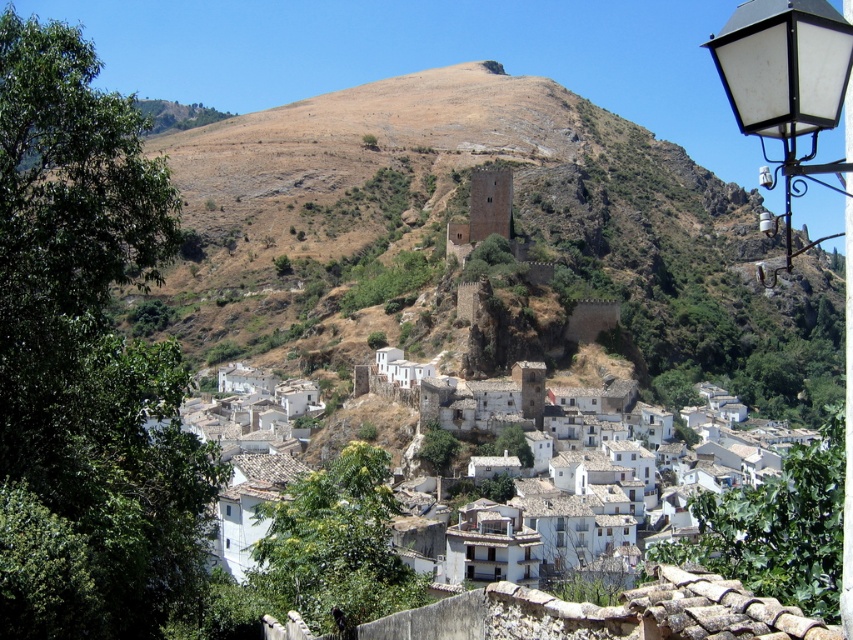
You are a tourist standing at the base of the hill, looking towards the village. You notice the white matte street light at upper right and the white stone buildings at center. Which object appears taller in the scene?

The white matte street light at upper right appears much taller than the white stone buildings at center in the scene.

You are a tourist standing in the village and want to take a photo that includes both the brown rocky mountain at center and the white stone buildings at center. Which object should you position closer to the edge of the frame to ensure both are fully visible?

You should position the white stone buildings at center closer to the edge of the frame because the brown rocky mountain at center is taller and might block part of the buildings if centered.